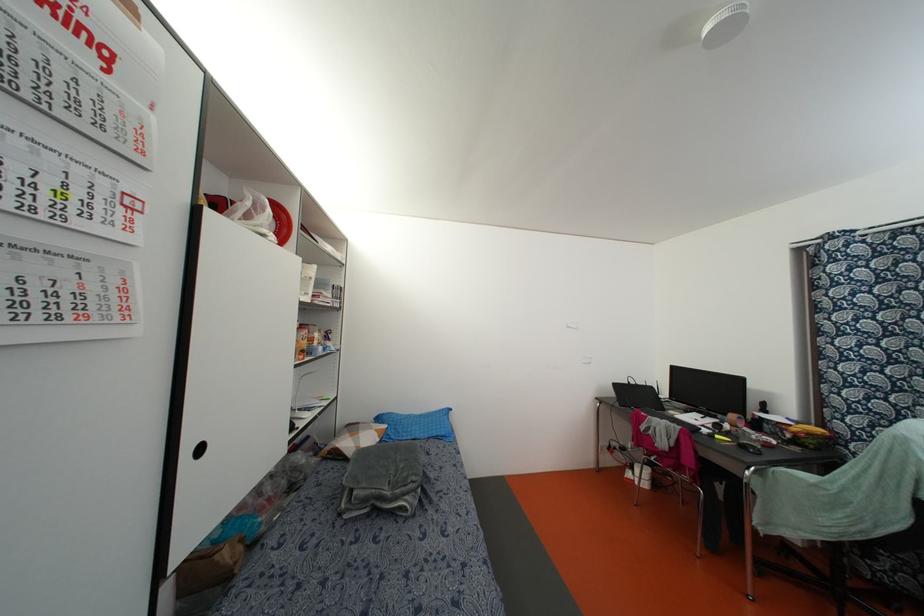
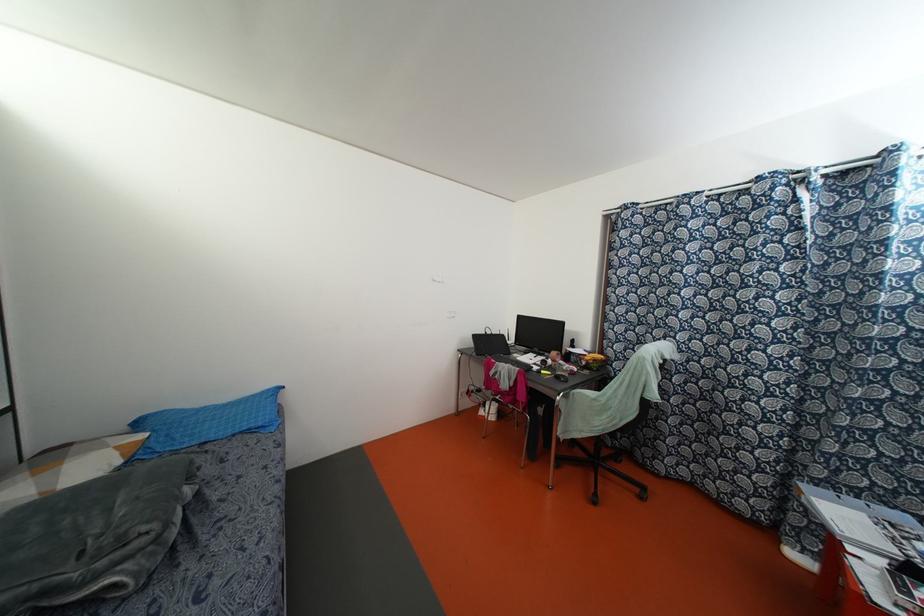
In the second image, find the point that corresponds to pixel 808 434 in the first image.

(593, 360)